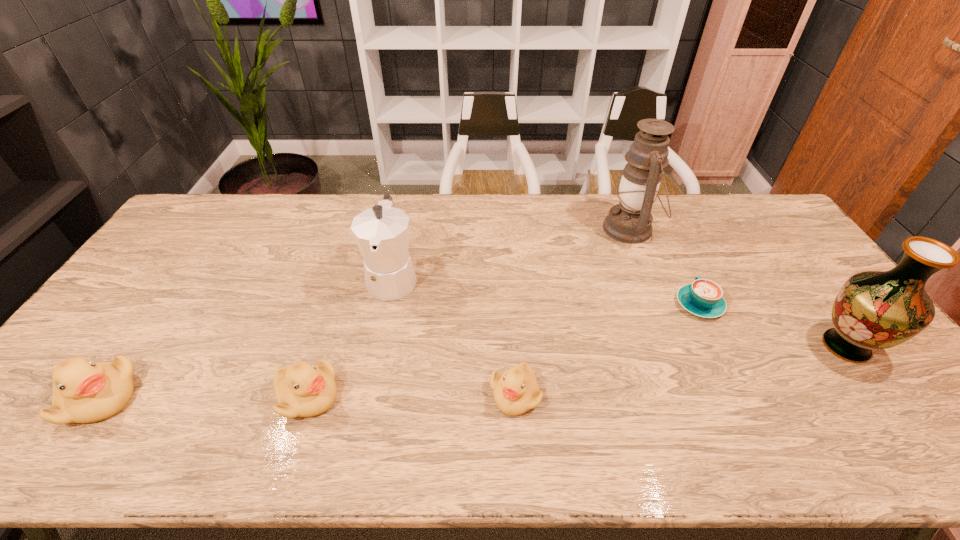
Locate an element on the screen. The width and height of the screenshot is (960, 540). vacant region between the second duckling from left to right and the sixth tallest object is located at coordinates (411, 395).

Locate an element on the screen. This screenshot has height=540, width=960. free point between the leftmost duckling and the coffeepot is located at coordinates (246, 338).

The image size is (960, 540). I want to click on vacant space that is in between the fifth tallest object and the oil lamp, so click(x=468, y=313).

Where is `unoccupied area between the second duckling from left to right and the vase`? unoccupied area between the second duckling from left to right and the vase is located at coordinates (577, 372).

In order to click on blank region between the coffeepot and the cappuccino in this screenshot , I will do `click(546, 291)`.

Locate an element on the screen. Image resolution: width=960 pixels, height=540 pixels. vacant space that is in between the rightmost object and the leftmost duckling is located at coordinates (472, 373).

Point out which object is positioned as the second nearest to the second shortest object. Please provide its 2D coordinates. Your answer should be formatted as a tuple, i.e. [(x, y)], where the tuple contains the x and y coordinates of a point satisfying the conditions above.

[(302, 390)]

Select which object is the sixth closest to the leftmost object. Please provide its 2D coordinates. Your answer should be formatted as a tuple, i.e. [(x, y)], where the tuple contains the x and y coordinates of a point satisfying the conditions above.

[(875, 310)]

Identify the location of duckling that is the second nearest to the oil lamp. (302, 390).

In order to click on duckling that is the second closest to the rightmost duckling in this screenshot , I will do `click(84, 391)`.